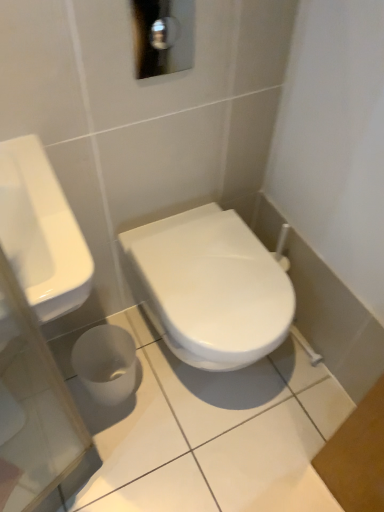
Question: Based on their positions, is white glossy sink at left located to the left or right of white glossy toilet at center?

Choices:
 (A) right
 (B) left

Answer: (B)

Question: Looking at the image, does white glossy sink at left seem bigger or smaller compared to white glossy toilet at center?

Choices:
 (A) big
 (B) small

Answer: (B)

Question: From a real-world perspective, is white glossy sink at left above or below white glossy toilet at center?

Choices:
 (A) above
 (B) below

Answer: (A)

Question: From a real-world perspective, relative to white glossy sink at left, is white glossy toilet at center vertically above or below?

Choices:
 (A) above
 (B) below

Answer: (B)

Question: From their relative heights in the image, would you say white glossy toilet at center is taller or shorter than white glossy sink at left?

Choices:
 (A) short
 (B) tall

Answer: (B)

Question: Which is correct: white glossy toilet at center is inside white glossy sink at left, or outside of it?

Choices:
 (A) inside
 (B) outside

Answer: (B)

Question: Visually, is white glossy toilet at center positioned to the left or to the right of white glossy sink at left?

Choices:
 (A) left
 (B) right

Answer: (B)